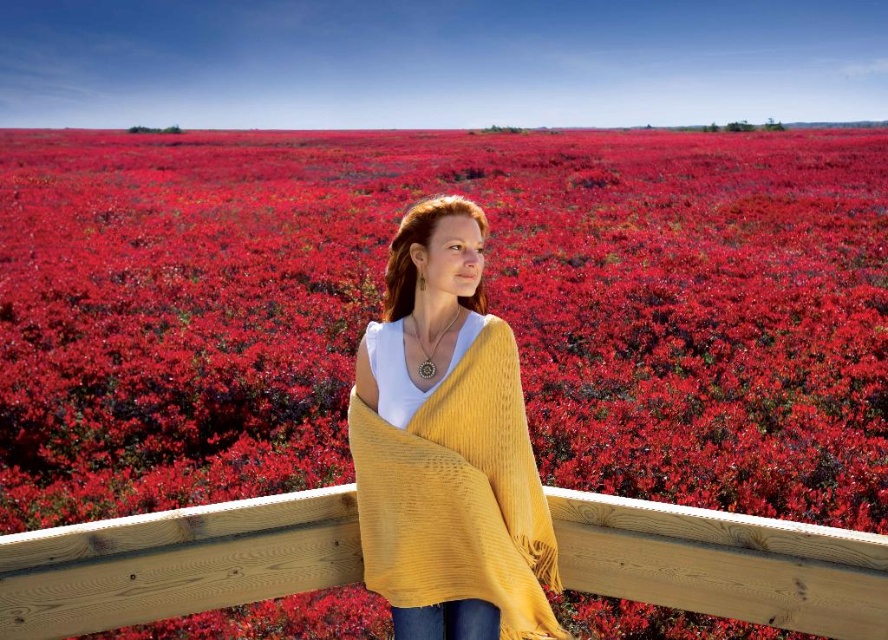
Which is more to the right, wooden rail at center or mustard knit shawl at center?

mustard knit shawl at center is more to the right.

Is wooden rail at center thinner than mustard knit shawl at center?

No, wooden rail at center is not thinner than mustard knit shawl at center.

The width and height of the screenshot is (888, 640). What are the coordinates of `wooden rail at center` in the screenshot? It's located at click(x=175, y=563).

The height and width of the screenshot is (640, 888). In order to click on wooden rail at center in this screenshot , I will do `click(175, 563)`.